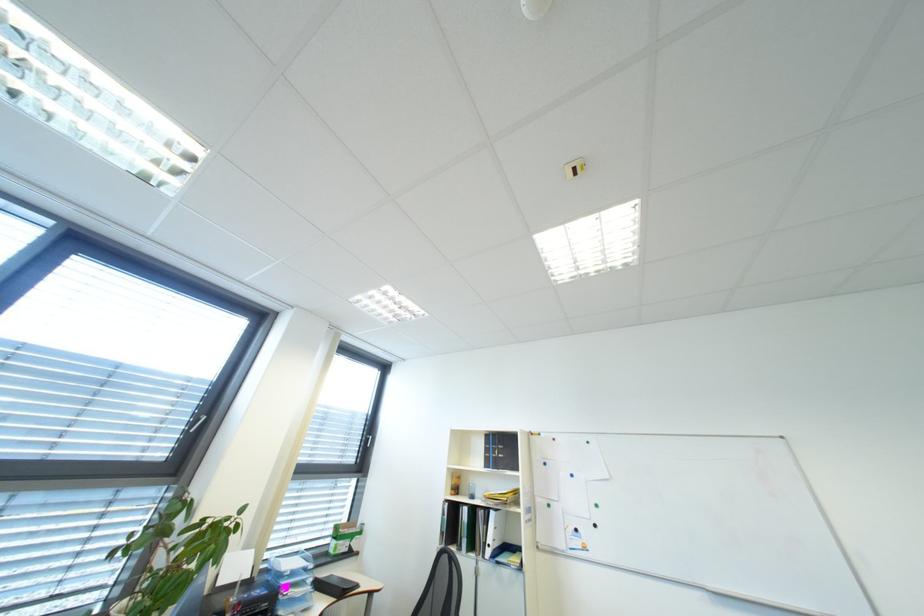
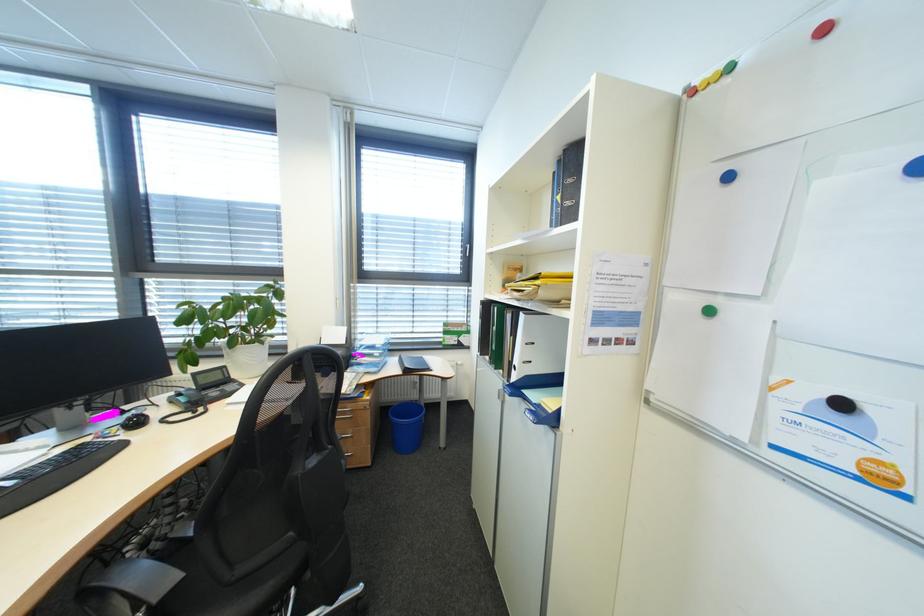
The point at (261, 578) is marked in the first image. Where is the corresponding point in the second image?

(355, 344)